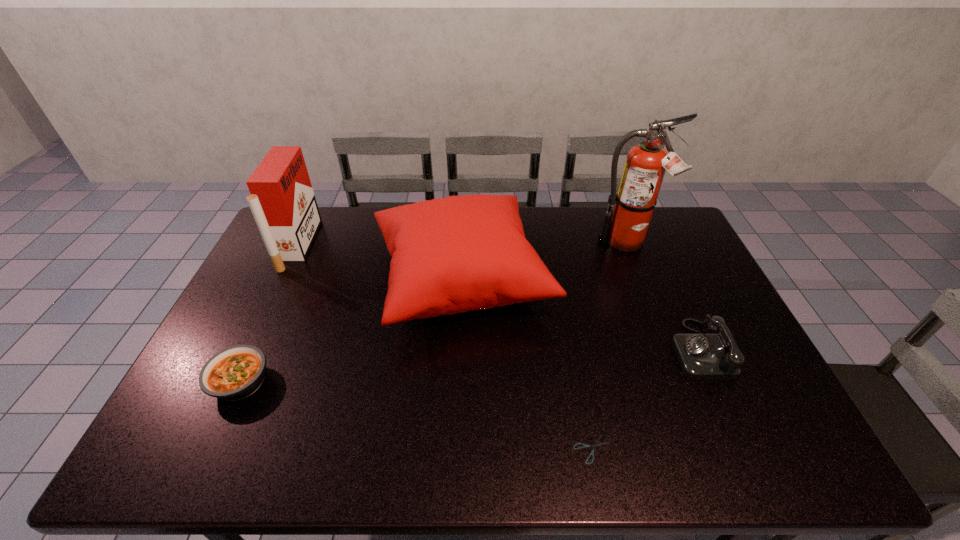
Locate an element on the screen. stew at the left edge is located at coordinates (234, 373).

Where is `fire extinguisher that is positioned at the right edge`? This screenshot has height=540, width=960. fire extinguisher that is positioned at the right edge is located at coordinates (625, 228).

At what (x,y) coordinates should I click in order to perform the action: click on telephone located at the right edge. Please return your answer as a coordinate pair (x, y). Looking at the image, I should click on (702, 356).

Where is `object situated at the far left corner`? The image size is (960, 540). object situated at the far left corner is located at coordinates (282, 201).

Find the location of a particular element. Image resolution: width=960 pixels, height=540 pixels. object at the far right corner is located at coordinates (625, 228).

The width and height of the screenshot is (960, 540). In the image, there is a desktop. What are the coordinates of `blank space at the far edge` in the screenshot? It's located at (594, 228).

In the image, there is a desktop. Identify the location of vacant space at the near edge. The height and width of the screenshot is (540, 960). tap(249, 439).

You are a GUI agent. You are given a task and a screenshot of the screen. Output one action in this format:
    pyautogui.click(x=<x>, y=<y>)
    Task: Click on the vacant area at the right edge
    
    Given the screenshot: What is the action you would take?
    pyautogui.click(x=652, y=256)

The height and width of the screenshot is (540, 960). I want to click on vacant space at the near right corner, so click(747, 439).

This screenshot has height=540, width=960. I want to click on vacant region between the third tallest object and the fire extinguisher, so click(x=543, y=261).